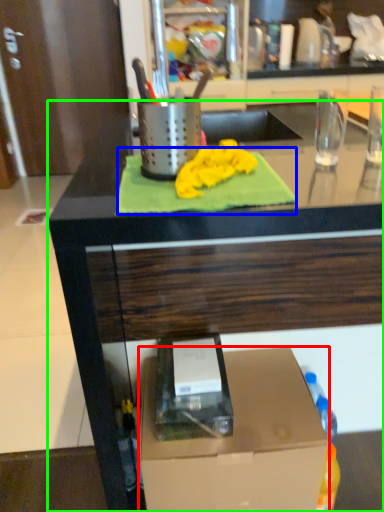
Question: Estimate the real-world distances between objects in this image. Which object is closer to box (highlighted by a red box), bath towel (highlighted by a blue box) or countertop (highlighted by a green box)?

Choices:
 (A) bath towel
 (B) countertop

Answer: (B)